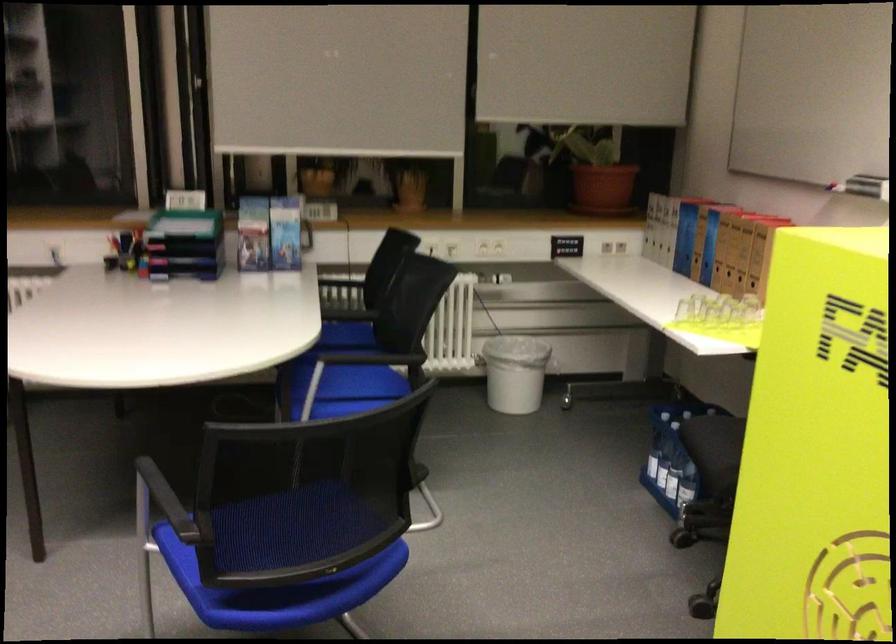
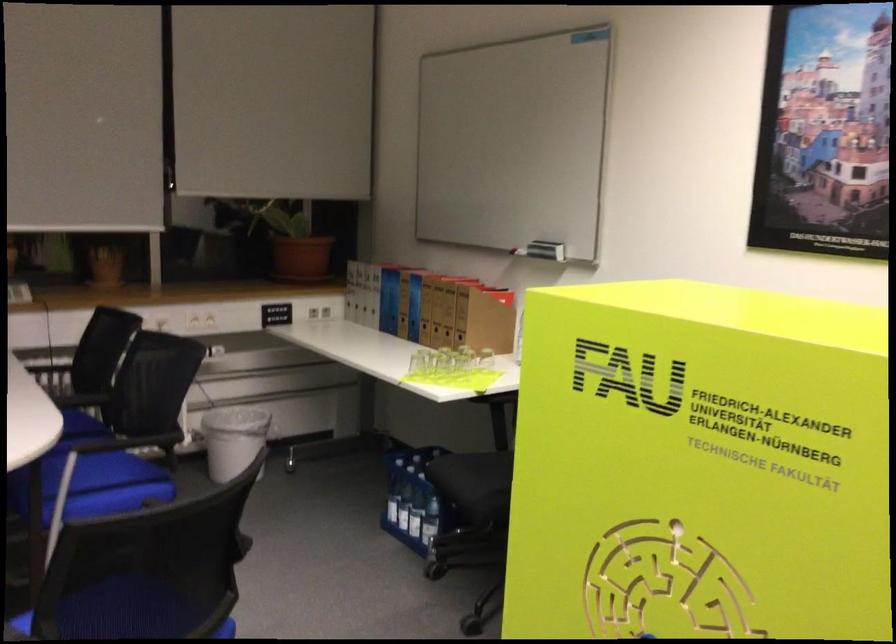
The point at (675, 469) is marked in the first image. Where is the corresponding point in the second image?

(416, 514)